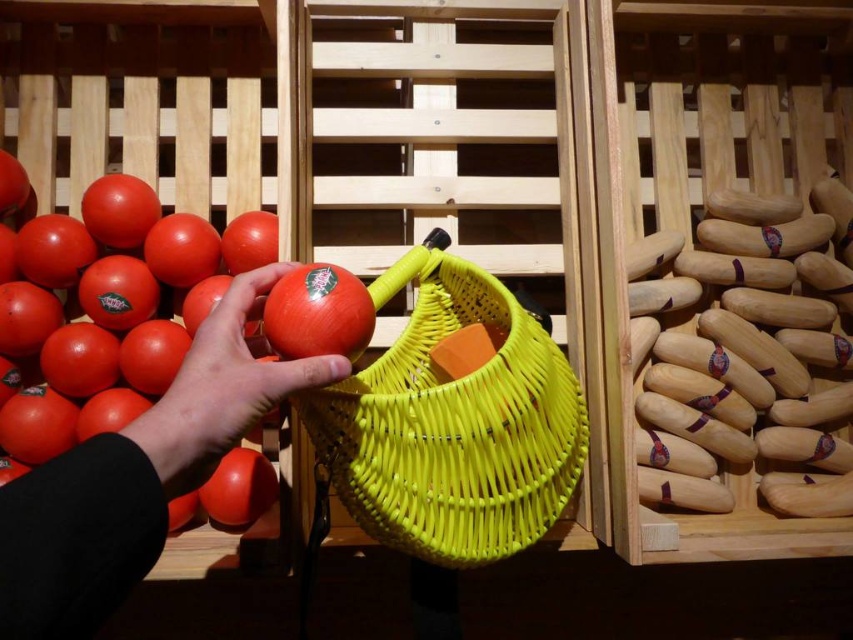
You are a customer at a store and you want to buy a tomato that is bigger than the one in your hand. You see the matte red tomato at left and the glossy plastic tomato at lower left. Which one should you choose?

The matte red tomato at left is larger in size compared to the glossy plastic tomato at lower left, so you should choose the matte red tomato at left.

You are a delivery robot with a 10 inch wide tray. You need to place the matte orange tomato at center into the yellow woven basket at center. Can your tray fit between them without touching either?

The distance between the yellow woven basket at center and the matte orange tomato at center is 9.28 inches. Since your tray is 10 inches wide, it is slightly wider than the space available. Therefore, the tray cannot fit between them without touching either object.

You are standing in a market and see the yellow woven basket at center. Can you tell me where the point with coordinates [453,422] is located in relation to the basket?

The point with coordinates [453,422] marks the yellow woven basket at center, so it is located exactly at the center of the basket.